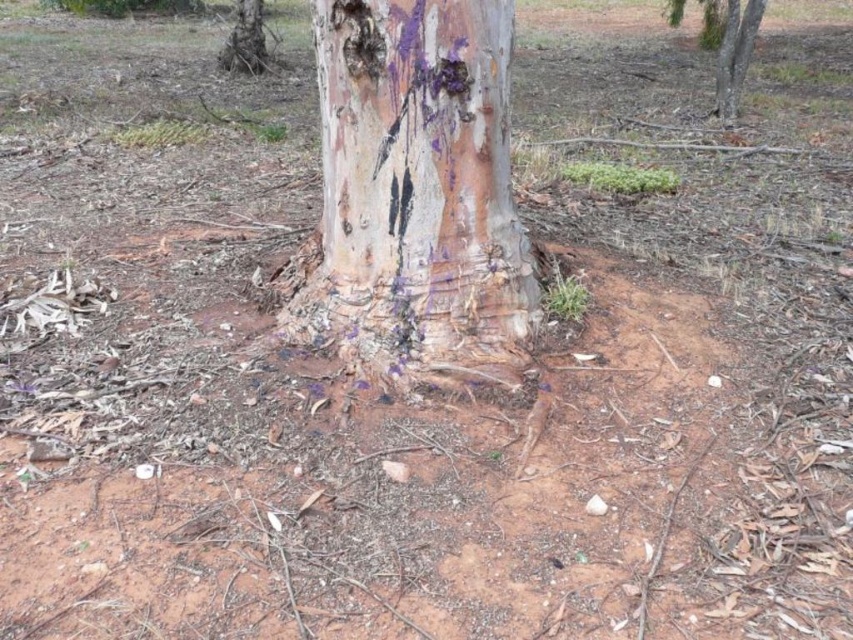
Question: Which point appears closest to the camera in this image?

Choices:
 (A) (244, 44)
 (B) (322, 164)

Answer: (B)

Question: Which is farther from the purple rough bark at upper right?

Choices:
 (A) purple rough bark at upper left
 (B) smooth bark tree trunk at center

Answer: (A)

Question: Estimate the real-world distances between objects in this image. Which object is closer to the smooth bark tree trunk at center?

Choices:
 (A) purple rough bark at upper left
 (B) purple rough bark at upper right

Answer: (B)

Question: Where is smooth bark tree trunk at center located in relation to purple rough bark at upper right in the image?

Choices:
 (A) right
 (B) left

Answer: (B)

Question: Does purple rough bark at upper right have a larger size compared to purple rough bark at upper left?

Choices:
 (A) no
 (B) yes

Answer: (B)

Question: Can you confirm if purple rough bark at upper right is smaller than purple rough bark at upper left?

Choices:
 (A) yes
 (B) no

Answer: (B)